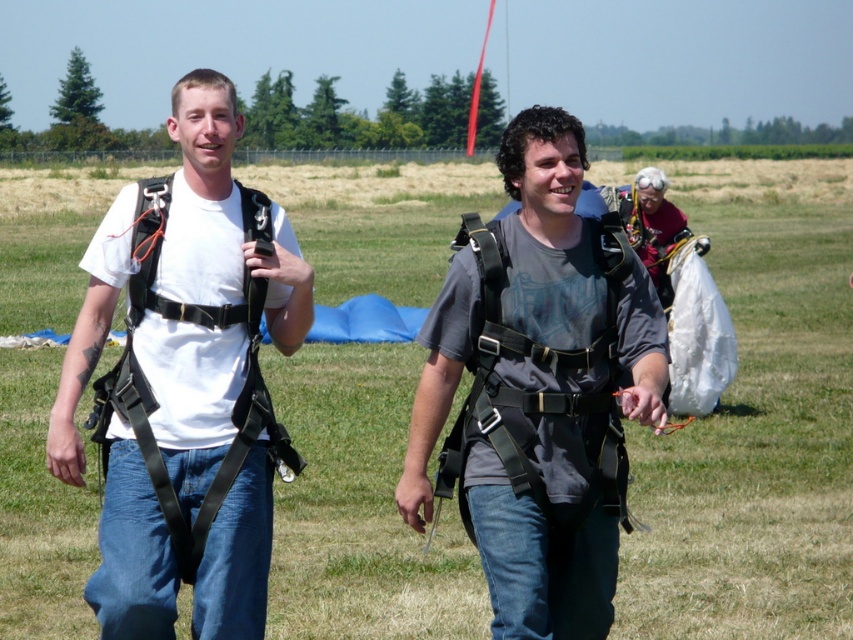
Question: Can you confirm if black matte harness at left is positioned to the left of gray matte harness at center?

Choices:
 (A) no
 (B) yes

Answer: (B)

Question: Which point is closer to the camera?

Choices:
 (A) black matte harness at left
 (B) gray matte harness at center

Answer: (B)

Question: Is black matte harness at left in front of gray matte harness at center?

Choices:
 (A) no
 (B) yes

Answer: (A)

Question: Among these objects, which one is farthest from the camera?

Choices:
 (A) black matte harness at left
 (B) gray matte harness at center

Answer: (A)

Question: Is black matte harness at left below gray matte harness at center?

Choices:
 (A) yes
 (B) no

Answer: (B)